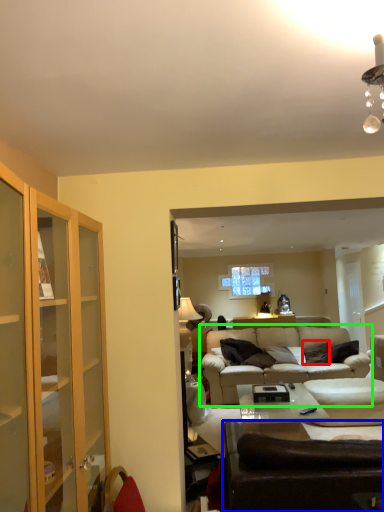
Question: Estimate the real-world distances between objects in this image. Which object is farther from pillow (highlighted by a red box), studio couch (highlighted by a blue box) or studio couch (highlighted by a green box)?

Choices:
 (A) studio couch
 (B) studio couch

Answer: (A)